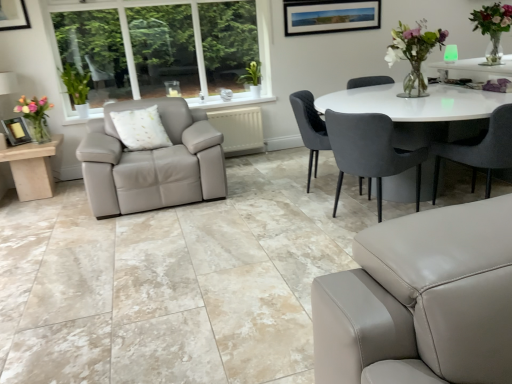
Image resolution: width=512 pixels, height=384 pixels. What do you see at coordinates (480, 149) in the screenshot?
I see `matte gray chair at right, the third chair positioned from the left` at bounding box center [480, 149].

Image resolution: width=512 pixels, height=384 pixels. Describe the element at coordinates (32, 168) in the screenshot. I see `beige marble side table at left` at that location.

Identify the location of green leafy plant at left. This screenshot has width=512, height=384. (75, 84).

Describe the element at coordinates (36, 117) in the screenshot. I see `translucent glass vase at left` at that location.

Identify the location of matte gray chair at right, the first chair viewed from the right. The height and width of the screenshot is (384, 512). click(x=480, y=149).

In terms of width, does velvet dark gray chair at center, which ranks as the second chair in left-to-right order, look wider or thinner when compared to translucent glass vase at left?

In the image, velvet dark gray chair at center, which ranks as the second chair in left-to-right order, appears to be wider than translucent glass vase at left.

Which is more to the right, velvet dark gray chair at center, which ranks as the second chair in left-to-right order, or translucent glass vase at left?

velvet dark gray chair at center, which ranks as the second chair in left-to-right order, is more to the right.

Where is `floral arrangement above the velvet dark gray chair at center, which is the second chair from right to left (from a real-world perspective)`? floral arrangement above the velvet dark gray chair at center, which is the second chair from right to left (from a real-world perspective) is located at coordinates (36, 117).

Who is shorter, velvet dark gray chair at center, which is the second chair from right to left, or matte gray chair at right, the third chair positioned from the left?

With less height is matte gray chair at right, the third chair positioned from the left.

Which is behind, point (339, 141) or point (504, 120)?

The point (339, 141) is behind.

Consider the image. Is velvet dark gray chair at center, which ranks as the second chair in left-to-right order, thinner than matte gray chair at right, the third chair positioned from the left?

Yes.

Which is in front, velvet dark gray chair at center, which is the second chair from right to left, or matte gray chair at right, the third chair positioned from the left?

matte gray chair at right, the third chair positioned from the left, is more forward.

In the scene shown: Does beige marble side table at left contain green leafy plant at left?

Definitely not — green leafy plant at left is not inside beige marble side table at left.

Is beige marble side table at left positioned in front of green leafy plant at left?

Yes.

Does beige marble side table at left turn towards green leafy plant at left?

No, beige marble side table at left does not turn towards green leafy plant at left.

Locate an element on the screen. The image size is (512, 384). plant above the beige marble side table at left (from the image's perspective) is located at coordinates (75, 84).

Looking at this image, is translucent glass vase at left looking in the opposite direction of matte black picture frame at lower left?

No, translucent glass vase at left's orientation is not away from matte black picture frame at lower left.

Based on the photo, from the image's perspective, is translucent glass vase at left on matte black picture frame at lower left?

Indeed, from the image's perspective, translucent glass vase at left is shown above matte black picture frame at lower left.

Is translucent glass vase at left smaller than matte black picture frame at lower left?

Actually, translucent glass vase at left might be larger than matte black picture frame at lower left.

Does translucent glass vase at left touch matte black picture frame at lower left?

No, translucent glass vase at left is not with matte black picture frame at lower left.

Visually, is matte black picture frame at lower left positioned to the left or to the right of velvet grey chair at center, arranged as the 3th chair when viewed from the right?

From the image, it's evident that matte black picture frame at lower left is to the left of velvet grey chair at center, arranged as the 3th chair when viewed from the right.

From a real-world perspective, is matte black picture frame at lower left positioned under velvet grey chair at center, arranged as the 3th chair when viewed from the right, based on gravity?

No.

From the picture: In terms of width, does matte black picture frame at lower left look wider or thinner when compared to velvet grey chair at center, arranged as the 3th chair when viewed from the right?

In the image, matte black picture frame at lower left appears to be more narrow than velvet grey chair at center, arranged as the 3th chair when viewed from the right.

Is matte black picture frame at lower left shorter than velvet grey chair at center, which is the first chair in left-to-right order?

Correct, matte black picture frame at lower left is not as tall as velvet grey chair at center, which is the first chair in left-to-right order.

In the scene shown: From a real-world perspective, who is located higher, matte gray chair at right, the third chair positioned from the left, or matte black picture frame at lower left?

matte black picture frame at lower left, from a real-world perspective.

Between matte gray chair at right, the first chair viewed from the right, and matte black picture frame at lower left, which one has larger size?

matte gray chair at right, the first chair viewed from the right.

Does matte gray chair at right, the third chair positioned from the left, lie behind matte black picture frame at lower left?

No, it is not.

Does point (503, 166) come farther from viewer compared to point (19, 130)?

That is False.

From the picture: Would you say velvet dark gray chair at center, which ranks as the second chair in left-to-right order, is part of translucent glass vase at left's contents?

Definitely not — velvet dark gray chair at center, which ranks as the second chair in left-to-right order, is not inside translucent glass vase at left.

From the image's perspective, is translucent glass vase at left over velvet dark gray chair at center, which ranks as the second chair in left-to-right order?

Yes, from the image's perspective, translucent glass vase at left is over velvet dark gray chair at center, which ranks as the second chair in left-to-right order.

Starting from the translucent glass vase at left, which chair is the 2nd one to the right? Please provide its 2D coordinates.

[(370, 151)]

Which of these two, translucent glass vase at left or velvet dark gray chair at center, which is the second chair from right to left, is thinner?

translucent glass vase at left.

Image resolution: width=512 pixels, height=384 pixels. What are the coordinates of `floral arrangement above the velvet dark gray chair at center, which ranks as the second chair in left-to-right order (from a real-world perspective)` in the screenshot? It's located at [36, 117].

Find the location of `chair on the right of velvet dark gray chair at center, which ranks as the second chair in left-to-right order`. chair on the right of velvet dark gray chair at center, which ranks as the second chair in left-to-right order is located at coordinates (480, 149).

Considering their positions, is beige marble side table at left positioned closer to green leafy plant at left than matte gray chair at right, the first chair viewed from the right?

Among the two, beige marble side table at left is located nearer to green leafy plant at left.

Considering their positions, is velvet dark gray chair at center, which ranks as the second chair in left-to-right order, positioned further to velvet grey chair at center, which is the first chair in left-to-right order, than beige marble side table at left?

beige marble side table at left is further to velvet grey chair at center, which is the first chair in left-to-right order.

Estimate the real-world distances between objects in this image. Which object is closer to green leafy plant at left, matte black picture frame at lower left or velvet grey chair at center, arranged as the 3th chair when viewed from the right?

Among the two, matte black picture frame at lower left is located nearer to green leafy plant at left.

Estimate the real-world distances between objects in this image. Which object is closer to green leafy plant at left, velvet dark gray chair at center, which ranks as the second chair in left-to-right order, or matte gray chair at right, the third chair positioned from the left?

velvet dark gray chair at center, which ranks as the second chair in left-to-right order, is closer to green leafy plant at left.

Based on their spatial positions, is velvet grey chair at center, which is the first chair in left-to-right order, or matte black picture frame at lower left further from velvet dark gray chair at center, which ranks as the second chair in left-to-right order?

The object further to velvet dark gray chair at center, which ranks as the second chair in left-to-right order, is matte black picture frame at lower left.

Estimate the real-world distances between objects in this image. Which object is further from green leafy plant at left, matte gray chair at right, the first chair viewed from the right, or velvet grey chair at center, which is the first chair in left-to-right order?

matte gray chair at right, the first chair viewed from the right, is positioned further to the anchor green leafy plant at left.

In the scene shown: When comparing their distances from velvet dark gray chair at center, which ranks as the second chair in left-to-right order, does translucent glass vase at left or matte gray chair at right, the third chair positioned from the left, seem closer?

matte gray chair at right, the third chair positioned from the left.

Estimate the real-world distances between objects in this image. Which object is closer to matte gray chair at right, the first chair viewed from the right, velvet grey chair at center, arranged as the 3th chair when viewed from the right, or beige marble side table at left?

velvet grey chair at center, arranged as the 3th chair when viewed from the right.

Where is `table situated between matte black picture frame at lower left and matte gray chair at right, the first chair viewed from the right, from left to right`? This screenshot has height=384, width=512. table situated between matte black picture frame at lower left and matte gray chair at right, the first chair viewed from the right, from left to right is located at coordinates (32, 168).

Locate an element on the screen. The image size is (512, 384). plant between matte black picture frame at lower left and matte gray chair at right, the first chair viewed from the right, in the horizontal direction is located at coordinates (75, 84).

Where is `picture frame positioned between translucent glass vase at left and green leafy plant at left from near to far`? This screenshot has height=384, width=512. picture frame positioned between translucent glass vase at left and green leafy plant at left from near to far is located at coordinates (16, 131).

Locate an element on the screen. The height and width of the screenshot is (384, 512). floral arrangement located between beige marble side table at left and velvet grey chair at center, which is the first chair in left-to-right order, in the left-right direction is located at coordinates (36, 117).